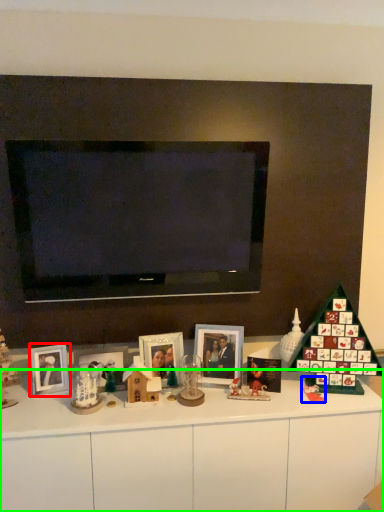
Question: Estimate the real-world distances between objects in this image. Which object is farther from picture frame (highlighted by a red box), toy (highlighted by a blue box) or dresser (highlighted by a green box)?

Choices:
 (A) toy
 (B) dresser

Answer: (A)